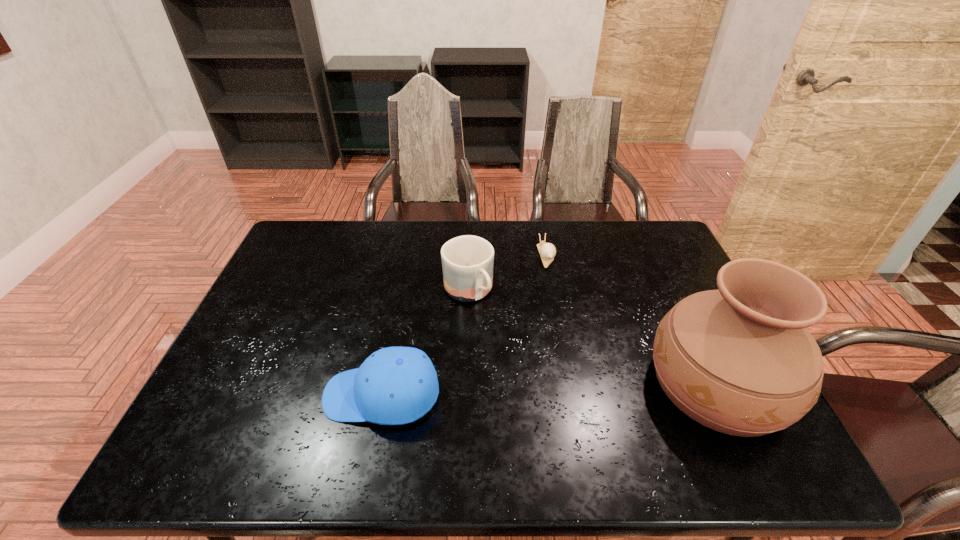
This screenshot has width=960, height=540. What are the coordinates of `object that is at the near right corner` in the screenshot? It's located at (739, 360).

At what (x,y) coordinates should I click in order to perform the action: click on vacant space at the far edge of the desktop. Please return your answer as a coordinate pair (x, y). Image resolution: width=960 pixels, height=540 pixels. Looking at the image, I should click on (410, 221).

Where is `free space at the near edge`? free space at the near edge is located at coordinates (664, 411).

This screenshot has width=960, height=540. In the image, there is a desktop. What are the coordinates of `vacant area at the left edge` in the screenshot? It's located at (291, 282).

The height and width of the screenshot is (540, 960). In order to click on vacant space at the right edge of the desktop in this screenshot , I will do `click(665, 288)`.

You are a GUI agent. You are given a task and a screenshot of the screen. Output one action in this format:
    pyautogui.click(x=<x>, y=<y>)
    Task: Click on the vacant space at the far left corner
    
    Given the screenshot: What is the action you would take?
    pyautogui.click(x=320, y=237)

At what (x,y) coordinates should I click in order to perform the action: click on free space at the near left corner of the desktop. Please return your answer as a coordinate pair (x, y). This screenshot has width=960, height=540. Looking at the image, I should click on (204, 422).

Image resolution: width=960 pixels, height=540 pixels. Identify the location of free space at the far right corner of the desktop. (673, 249).

Identify the location of free space that is in between the cap and the mug. The image size is (960, 540). (425, 343).

At what (x,y) coordinates should I click in order to perform the action: click on free space between the third nearest object and the rightmost object. Please return your answer as a coordinate pair (x, y). The height and width of the screenshot is (540, 960). Looking at the image, I should click on (593, 338).